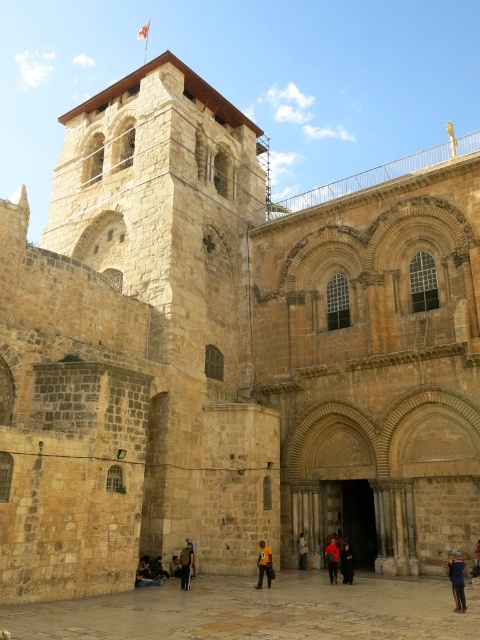
Question: Based on their relative distances, which object is nearer to the yellow fabric at center?

Choices:
 (A) dark brown leather jacket at lower left
 (B) red fabric jacket at center
 (C) dark red fabric at center

Answer: (C)

Question: Is dark brown leather jacket at lower center positioned at the back of dark red fabric at center?

Choices:
 (A) no
 (B) yes

Answer: (A)

Question: Does yellow fabric at center appear on the left side of dark red fabric at center?

Choices:
 (A) yes
 (B) no

Answer: (A)

Question: Which object is closer to the camera taking this photo?

Choices:
 (A) dark red fabric at center
 (B) dark brown leather jacket at lower center

Answer: (B)

Question: Which object is positioned closest to the dark brown leather jacket at lower center?

Choices:
 (A) red fabric jacket at center
 (B) orange fabric jacket at center
 (C) dark red fabric at center

Answer: (C)

Question: Can you confirm if dark brown leather jacket at center is smaller than orange fabric jacket at center?

Choices:
 (A) no
 (B) yes

Answer: (A)